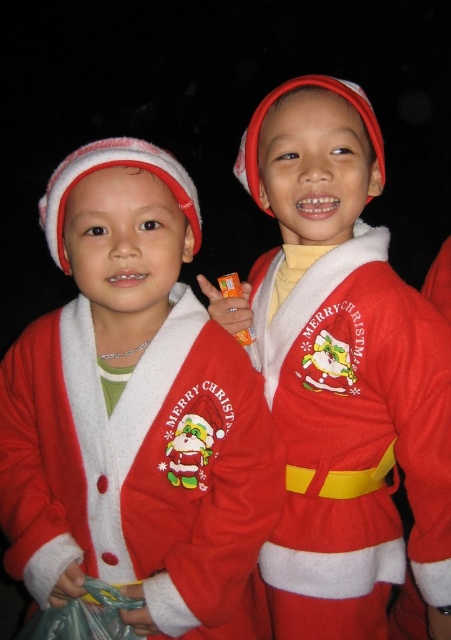
How far apart are fuzzy red santa coat at center and fuzzy red santa costume at center?

fuzzy red santa coat at center is 7.89 inches from fuzzy red santa costume at center.

Is point (44, 536) farther from viewer compared to point (303, 508)?

No.

Identify the location of fuzzy red santa coat at center. The width and height of the screenshot is (451, 640). (134, 410).